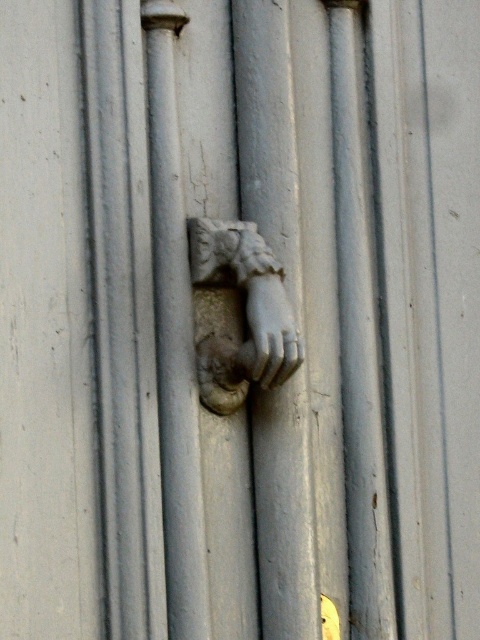
You are standing 1.5 meters away from the decorative door knocker embedded into the vertical surface. Can you reach the point at coordinates point (x=250, y=308) without moving closer?

The distance of point (x=250, y=308) from viewer is 1.46 meters, so yes, you can reach it without moving closer since you are standing 1.5 meters away which is slightly farther than the point.

You are a sculptor working on a door knocker design. You have two options for the hand motif, the stone textured hand at center and the white marble hand at center. If you want to ensure there is at least 1 inch of space between them for visibility, which placement should you choose?

The stone textured hand at center is only 0.69 inches from the white marble hand at center, which is less than the desired 1 inch of space. To achieve the required spacing, you should place them farther apart.